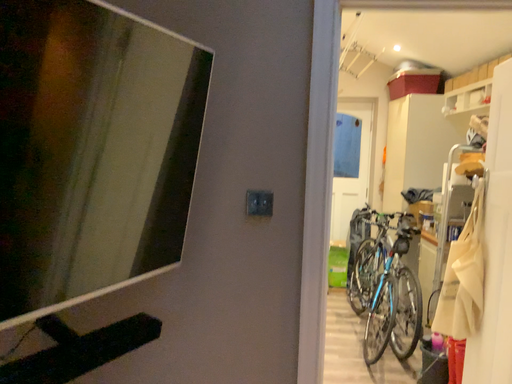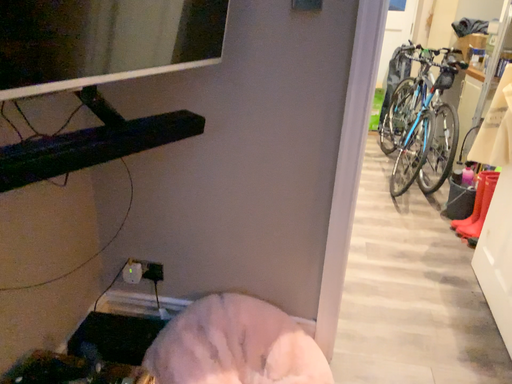
Question: Which way did the camera rotate in the video?

Choices:
 (A) rotated downward
 (B) rotated upward

Answer: (A)